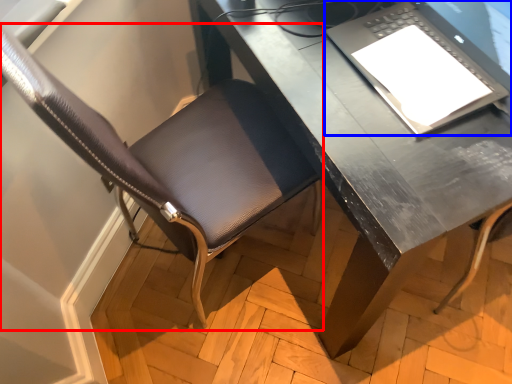
Question: Which object is closer to the camera taking this photo, chair (highlighted by a red box) or laptop (highlighted by a blue box)?

Choices:
 (A) chair
 (B) laptop

Answer: (A)